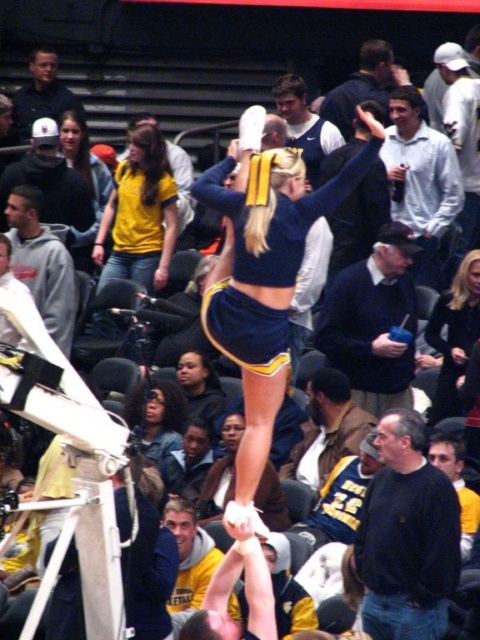
Is matte blue uniform at center shorter than yellow matte shirt at center?

Incorrect, matte blue uniform at center's height does not fall short of yellow matte shirt at center's.

I want to click on matte blue uniform at center, so click(x=264, y=269).

Is point (254, 289) closer to viewer compared to point (156, 161)?

Yes, it is.

This screenshot has height=640, width=480. I want to click on matte blue uniform at center, so click(x=264, y=269).

What do you see at coordinates (264, 269) in the screenshot? I see `matte blue uniform at center` at bounding box center [264, 269].

Measure the distance from matte blue uniform at center to dark blue hoodie at center.

They are 9.38 meters apart.

Image resolution: width=480 pixels, height=640 pixels. What do you see at coordinates (264, 269) in the screenshot?
I see `matte blue uniform at center` at bounding box center [264, 269].

Locate an element on the screen. This screenshot has width=480, height=640. matte blue uniform at center is located at coordinates (264, 269).

The image size is (480, 640). Describe the element at coordinates (455, 333) in the screenshot. I see `black leather jacket at lower right` at that location.

Can you confirm if black leather jacket at lower right is positioned to the left of dark brown hair at center?

In fact, black leather jacket at lower right is to the right of dark brown hair at center.

Between point (472, 252) and point (176, 390), which one is positioned in front?

Point (176, 390)

The height and width of the screenshot is (640, 480). In order to click on black leather jacket at lower right in this screenshot , I will do `click(455, 333)`.